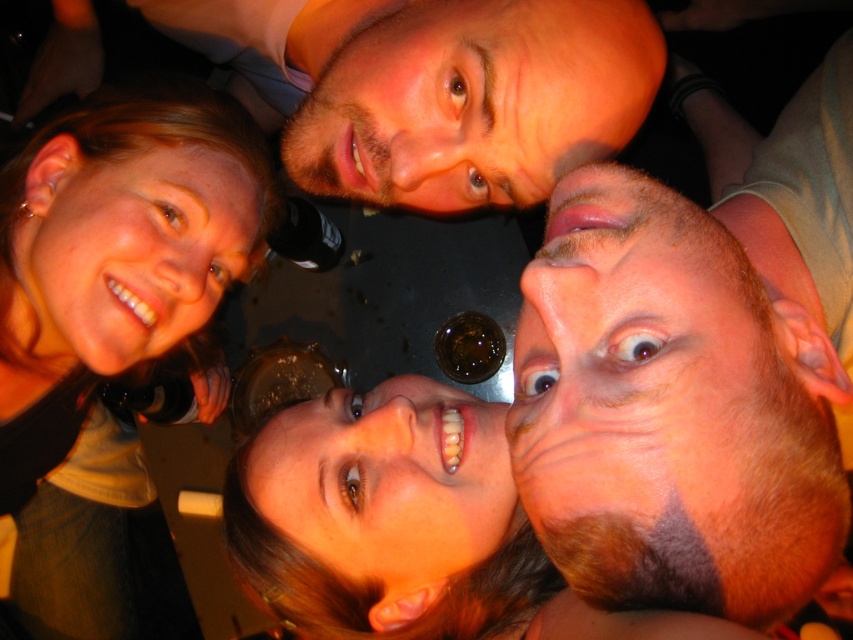
In the scene shown: In the image, there is a point labeled at coordinates (697, 378). Based on the scene description, what feature does this point most likely represent?

The point at coordinates (697, 378) most likely represents the brown hair at center as described in the scene.

You are a photographer trying to adjust the framing of this image. Since the photo is taken from a low angle, you want to ensure both the matte black hair at upper left and the bearded man at upper center are fully visible. Based on their positions, which object might require more adjustment to prevent being cut off?

The matte black hair at upper left might require more adjustment because it is wider than the bearded man at upper center, so it could extend further into the frame and risk being cut off if not properly positioned.

Based on the scene description, where exactly is the brown hair at center located in the image?

The brown hair at center is located at point coordinates of 0.592 on the x axis and 0.818 on the y axis.